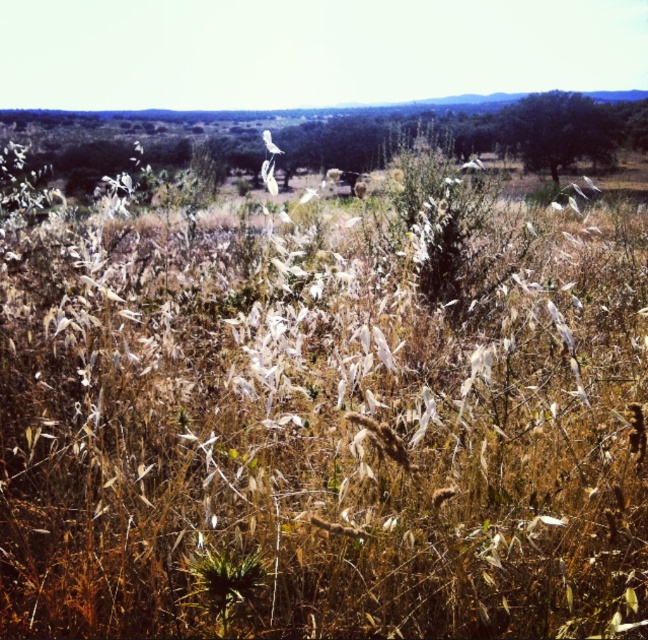
Question: Observing the image, what is the correct spatial positioning of green leafy tree at upper right in reference to white matte bird at center?

Choices:
 (A) right
 (B) left

Answer: (A)

Question: Which of the following is the farthest from the observer?

Choices:
 (A) (527, 132)
 (B) (268, 148)

Answer: (A)

Question: Can you confirm if green leafy tree at upper right is thinner than white matte bird at center?

Choices:
 (A) yes
 (B) no

Answer: (B)

Question: Among these objects, which one is nearest to the camera?

Choices:
 (A) white matte bird at center
 (B) green leafy tree at upper right

Answer: (A)

Question: Which object is closer to the camera taking this photo?

Choices:
 (A) white matte bird at center
 (B) green leafy tree at upper right

Answer: (A)

Question: Does green leafy tree at upper right have a larger size compared to white matte bird at center?

Choices:
 (A) no
 (B) yes

Answer: (A)